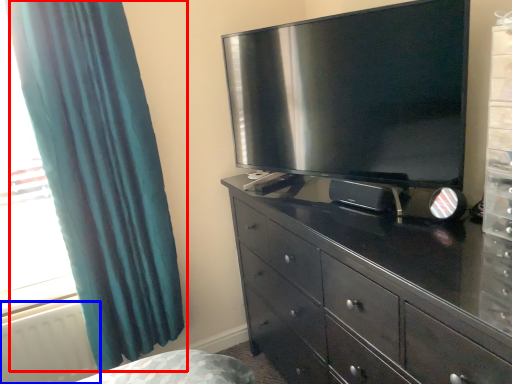
Question: Among these objects, which one is farthest to the camera, curtain (highlighted by a red box) or radiator (highlighted by a blue box)?

Choices:
 (A) curtain
 (B) radiator

Answer: (B)